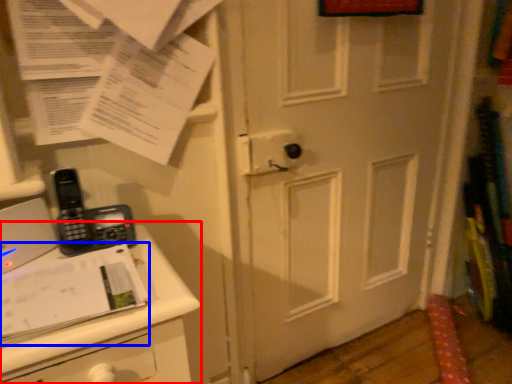
Question: Which object is further to the camera taking this photo, changing table (highlighted by a red box) or journal (highlighted by a blue box)?

Choices:
 (A) changing table
 (B) journal

Answer: (B)